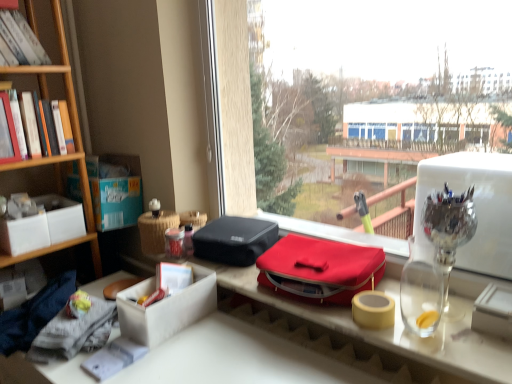
I want to click on free point behind transparent glass pen holder at upper right, so click(x=420, y=293).